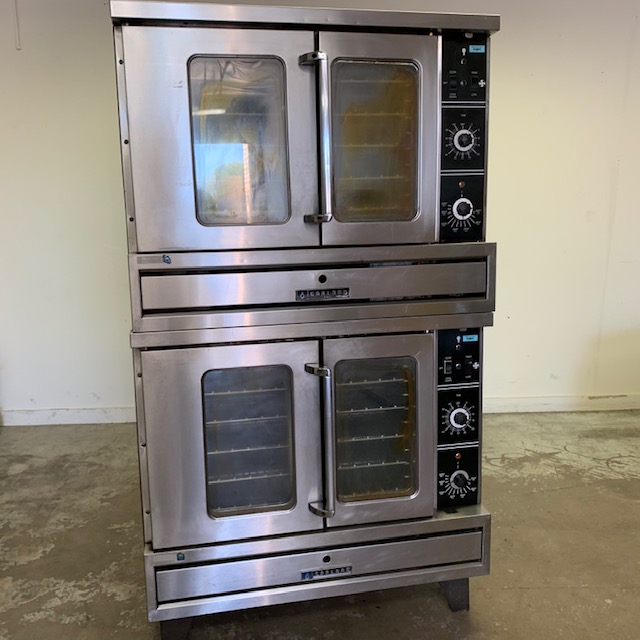
Locate an element on the screen. This screenshot has height=640, width=640. oven drawers is located at coordinates (230, 294), (230, 573).